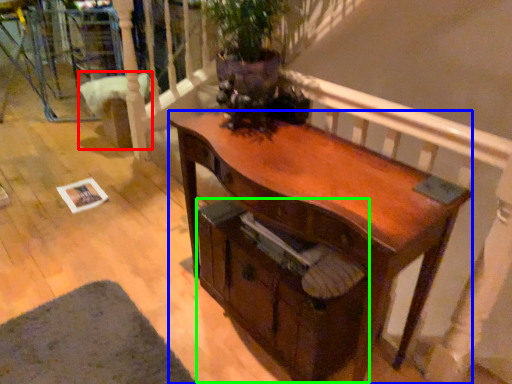
Question: Which is nearer to the armchair (highlighted by a red box)? desk (highlighted by a blue box) or drawer (highlighted by a green box).

Choices:
 (A) desk
 (B) drawer

Answer: (B)